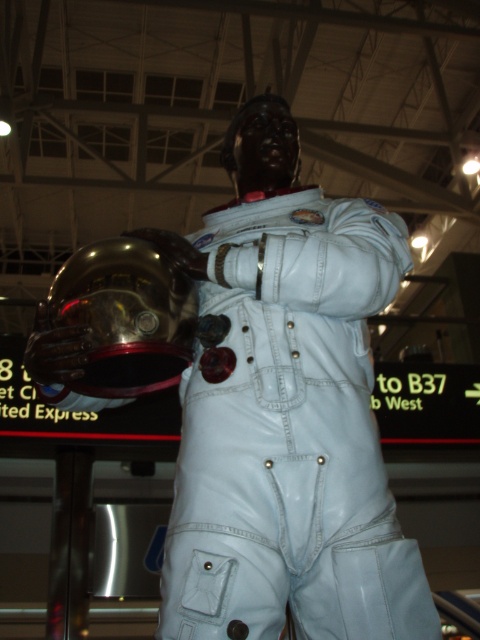
Can you confirm if white glossy astronaut at center is wider than glossy metallic helmet at center?

Yes.

Is point (343, 280) farther from viewer compared to point (124, 387)?

No, it is in front of (124, 387).

What do you see at coordinates (287, 412) in the screenshot? Image resolution: width=480 pixels, height=640 pixels. I see `white glossy astronaut at center` at bounding box center [287, 412].

This screenshot has width=480, height=640. Identify the location of white glossy astronaut at center. (287, 412).